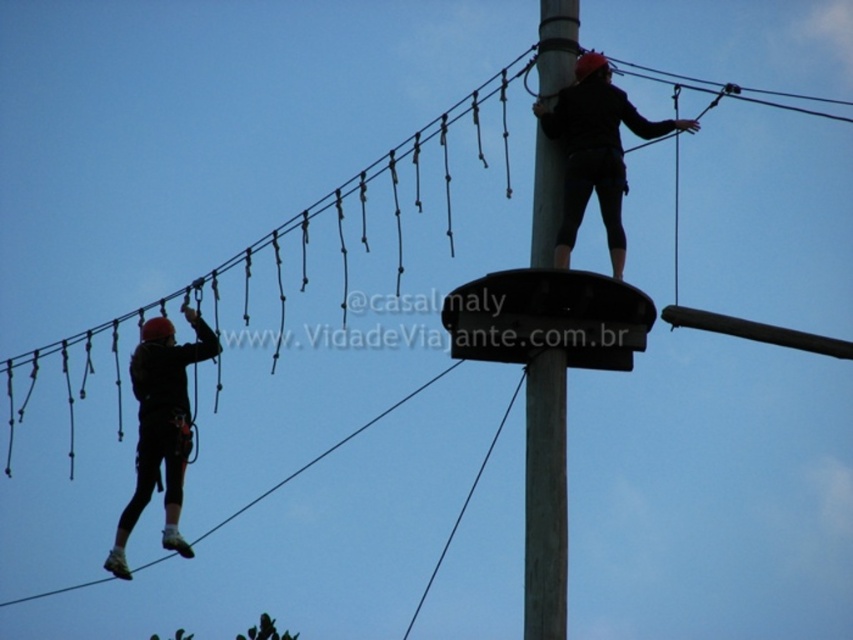
Which of these two, gray metallic pole at center or black matte helmet at left, stands taller?

gray metallic pole at center is taller.

Can you confirm if gray metallic pole at center is positioned to the right of black matte helmet at left?

Yes, gray metallic pole at center is to the right of black matte helmet at left.

Which is behind, point (556, 616) or point (146, 346)?

The point (146, 346) is more distant.

I want to click on gray metallic pole at center, so click(x=544, y=499).

Looking at this image, is black matte helmet at upper center wider than black matte helmet at left?

Yes, black matte helmet at upper center is wider than black matte helmet at left.

Who is lower down, black matte helmet at upper center or black matte helmet at left?

black matte helmet at left is below.

Which is in front, point (619, 262) or point (132, 387)?

Point (619, 262) is in front.

The width and height of the screenshot is (853, 640). What are the coordinates of `black matte helmet at upper center` in the screenshot? It's located at (595, 150).

Is point (564, 573) in front of point (619, 122)?

Yes, it is in front of point (619, 122).

Does point (543, 84) come behind point (619, 163)?

Yes, point (543, 84) is farther from viewer.

At what (x,y) coordinates should I click in order to perform the action: click on gray metallic pole at center. Please return your answer as a coordinate pair (x, y). This screenshot has width=853, height=640. Looking at the image, I should click on (x=544, y=499).